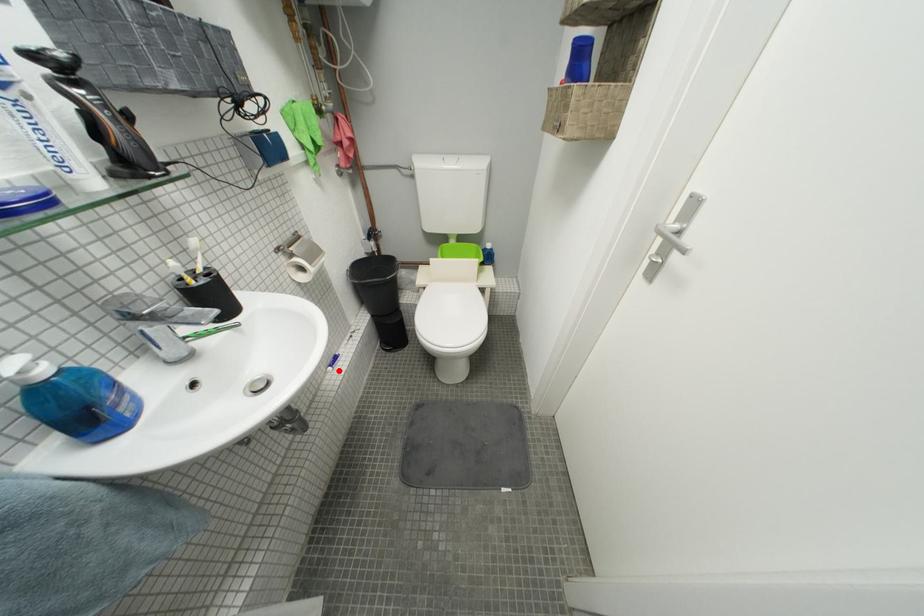
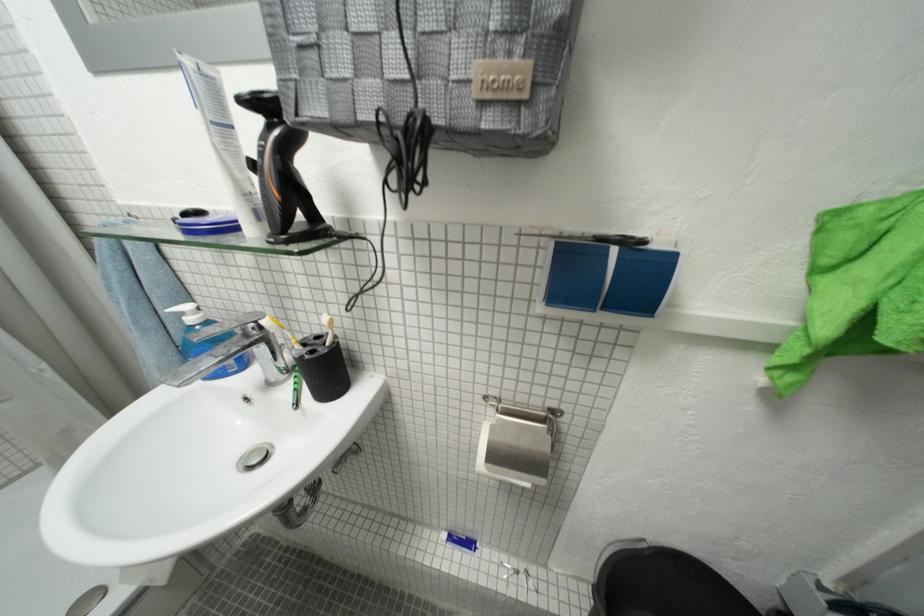
Question: I am providing you with two images of the same scene from different viewpoints. Image1 has a red point marked. In image2, the corresponding 3D location appears at what relative position? Reply with the corresponding letter.

Choices:
 (A) Closer
 (B) Farther

Answer: (B)